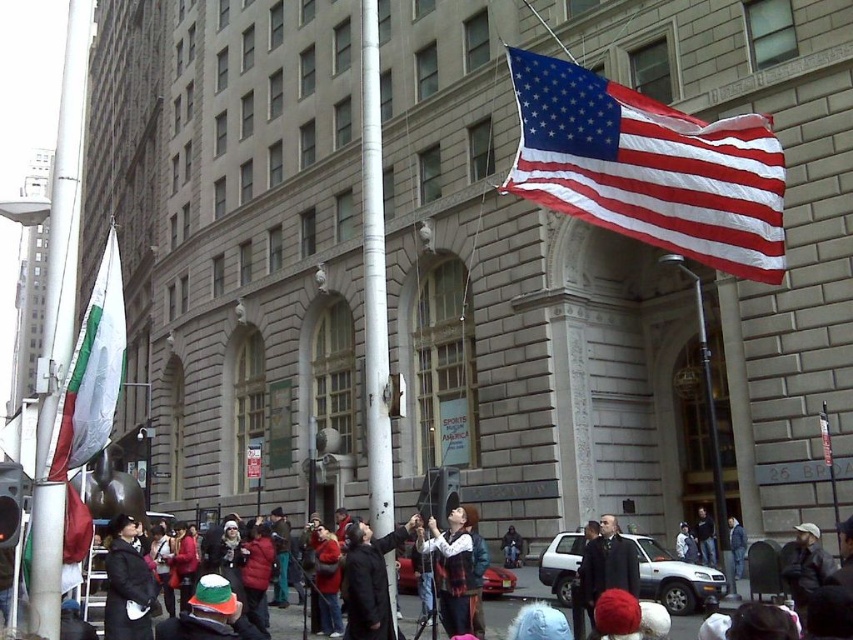
Question: Does white fabric flag at left have a smaller size compared to denim jacket at lower right?

Choices:
 (A) yes
 (B) no

Answer: (B)

Question: Which object is positioned closest to the dark gray wool coat at lower center?

Choices:
 (A) white cotton jacket at center
 (B) matte black jacket at center
 (C) dark blue jeans at center

Answer: (A)

Question: Does dark blue jeans at center lie behind matte black jacket at center?

Choices:
 (A) yes
 (B) no

Answer: (B)

Question: Observing the image, what is the correct spatial positioning of dark blue jeans at center in reference to denim jacket at lower right?

Choices:
 (A) below
 (B) above

Answer: (A)

Question: Estimate the real-world distances between objects in this image. Which object is closer to the dark gray wool coat at lower center?

Choices:
 (A) american flag at upper right
 (B) white fabric flag at left

Answer: (A)

Question: Which of the following is the closest to the observer?

Choices:
 (A) dark gray wool coat at lower center
 (B) matte black jacket at center
 (C) white cotton jacket at center
 (D) american flag at upper right

Answer: (D)